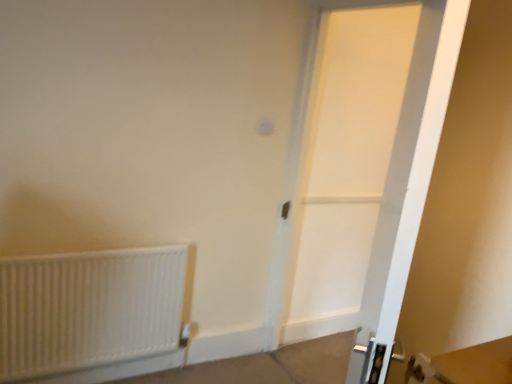
Question: Could you tell me if white matte radiator at lower left is facing white matte door at center?

Choices:
 (A) no
 (B) yes

Answer: (A)

Question: Considering the relative positions of white matte radiator at lower left and white matte door at center in the image provided, is white matte radiator at lower left to the right of white matte door at center from the viewer's perspective?

Choices:
 (A) yes
 (B) no

Answer: (B)

Question: Does white matte radiator at lower left come in front of white matte door at center?

Choices:
 (A) no
 (B) yes

Answer: (A)

Question: Can we say white matte radiator at lower left lies outside white matte door at center?

Choices:
 (A) no
 (B) yes

Answer: (B)

Question: Considering the relative sizes of white matte radiator at lower left and white matte door at center in the image provided, is white matte radiator at lower left bigger than white matte door at center?

Choices:
 (A) no
 (B) yes

Answer: (A)

Question: Is the position of white matte radiator at lower left more distant than that of white matte door at center?

Choices:
 (A) no
 (B) yes

Answer: (B)

Question: From a real-world perspective, is white matte door at center on top of white matte radiator at lower left?

Choices:
 (A) no
 (B) yes

Answer: (B)

Question: Considering the relative sizes of white matte door at center and white matte radiator at lower left in the image provided, is white matte door at center smaller than white matte radiator at lower left?

Choices:
 (A) no
 (B) yes

Answer: (A)

Question: From a real-world perspective, is white matte door at center under white matte radiator at lower left?

Choices:
 (A) no
 (B) yes

Answer: (A)

Question: Considering the relative sizes of white matte door at center and white matte radiator at lower left in the image provided, is white matte door at center shorter than white matte radiator at lower left?

Choices:
 (A) yes
 (B) no

Answer: (B)

Question: Is white matte door at center looking in the opposite direction of white matte radiator at lower left?

Choices:
 (A) no
 (B) yes

Answer: (A)

Question: Can you confirm if white matte door at center is taller than white matte radiator at lower left?

Choices:
 (A) no
 (B) yes

Answer: (B)

Question: Is white matte radiator at lower left to the left or to the right of white matte door at center in the image?

Choices:
 (A) left
 (B) right

Answer: (A)